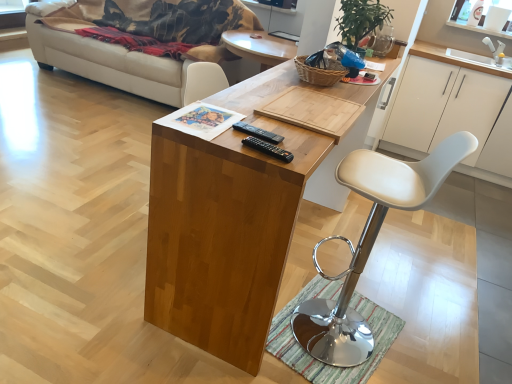
Identify the location of free location in front of woven brown basket at upper center. This screenshot has height=384, width=512. (312, 88).